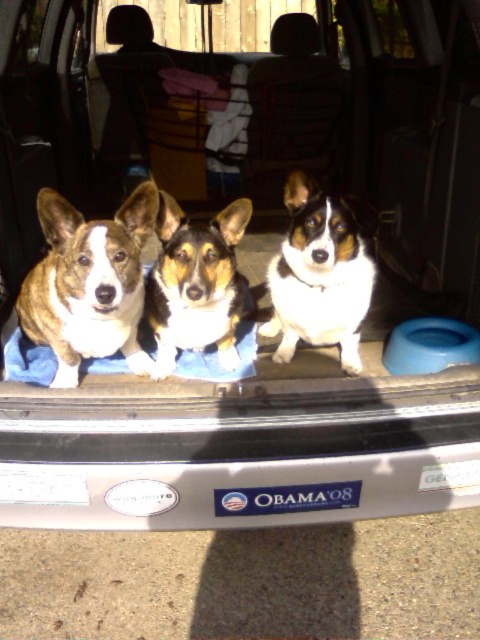
You are a photographer trying to capture the three Corgi dogs in the trunk. You want to focus on the dog at point (312, 218) and the dog at point (167, 337). Which of these two dogs is closer to the camera?

Point (312, 218) is in front of point (167, 337), so the dog at point (312, 218) is closer to the camera.

You are a photographer taking a picture of the white fur dog at center and the brown and white fur at center inside the car trunk. Which dog should you focus on first if you want to capture both in the same frame without moving the camera?

The white fur dog at center is located below the brown and white fur at center, so you should focus on the brown and white fur at center first to ensure both are in the frame.